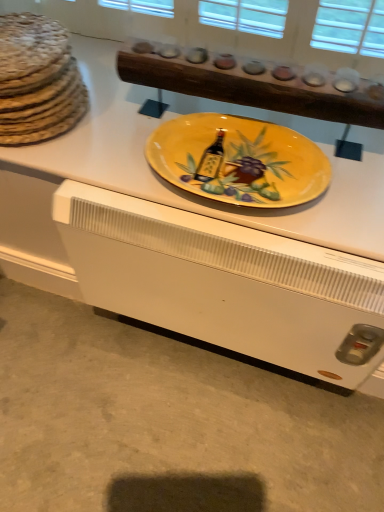
Question: Considering the positions of brown textured bread at left and white matte heater at lower center in the image, is brown textured bread at left wider or thinner than white matte heater at lower center?

Choices:
 (A) thin
 (B) wide

Answer: (A)

Question: Based on their sizes in the image, would you say brown textured bread at left is bigger or smaller than white matte heater at lower center?

Choices:
 (A) small
 (B) big

Answer: (A)

Question: Estimate the real-world distances between objects in this image. Which object is closer to the brown textured bread at left?

Choices:
 (A) yellow glossy plate at center
 (B) yellow ceramic plate at center
 (C) white matte heater at lower center

Answer: (A)

Question: Estimate the real-world distances between objects in this image. Which object is farther from the white matte heater at lower center?

Choices:
 (A) yellow ceramic plate at center
 (B) brown textured bread at left
 (C) yellow glossy plate at center

Answer: (B)